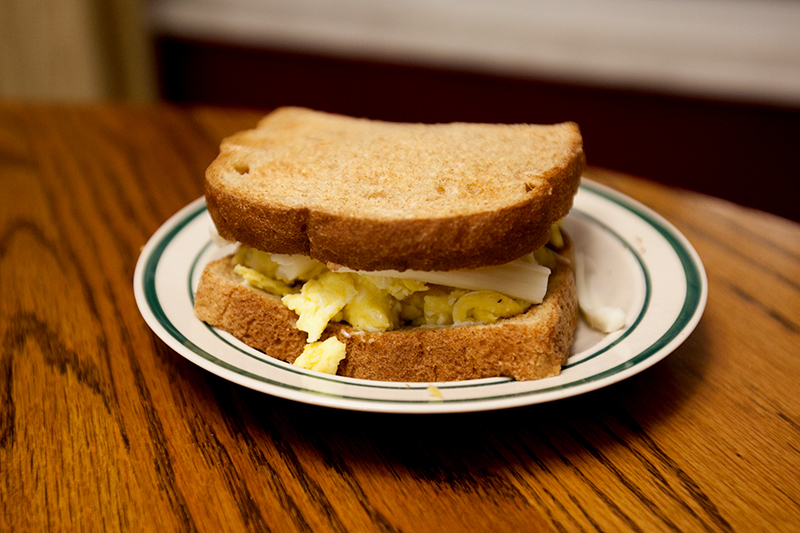
Find the location of a particular element. This screenshot has height=533, width=800. plate is located at coordinates (625, 317).